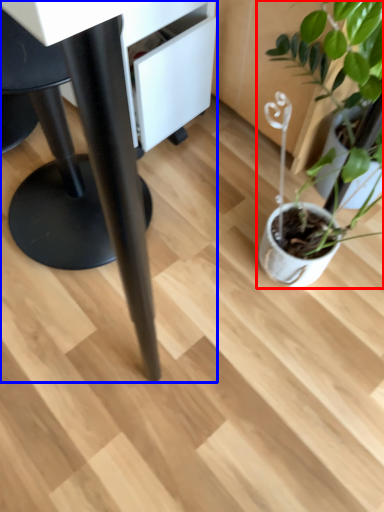
Question: Which point is closer to the camera, houseplant (highlighted by a red box) or table (highlighted by a blue box)?

Choices:
 (A) houseplant
 (B) table

Answer: (B)